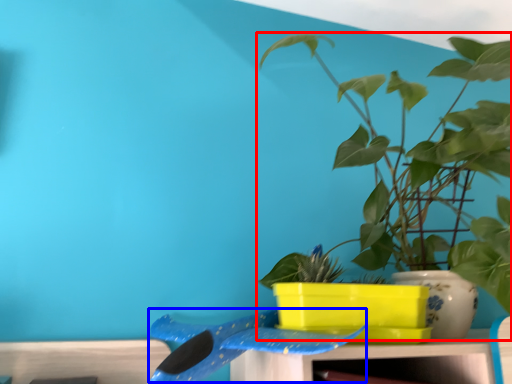
Question: Which point is closer to the camera, houseplant (highlighted by a red box) or whale (highlighted by a blue box)?

Choices:
 (A) houseplant
 (B) whale

Answer: (A)